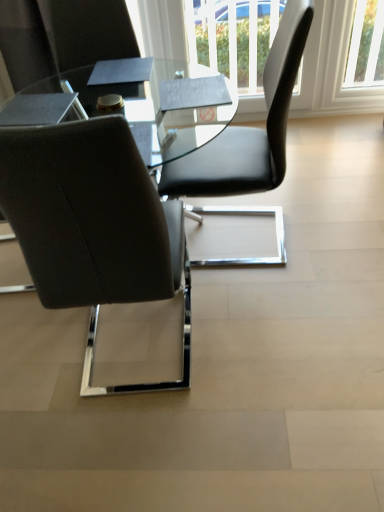
Where is `vacant region in front of matte black chair at left, the 2th chair from the right`? vacant region in front of matte black chair at left, the 2th chair from the right is located at coordinates (144, 447).